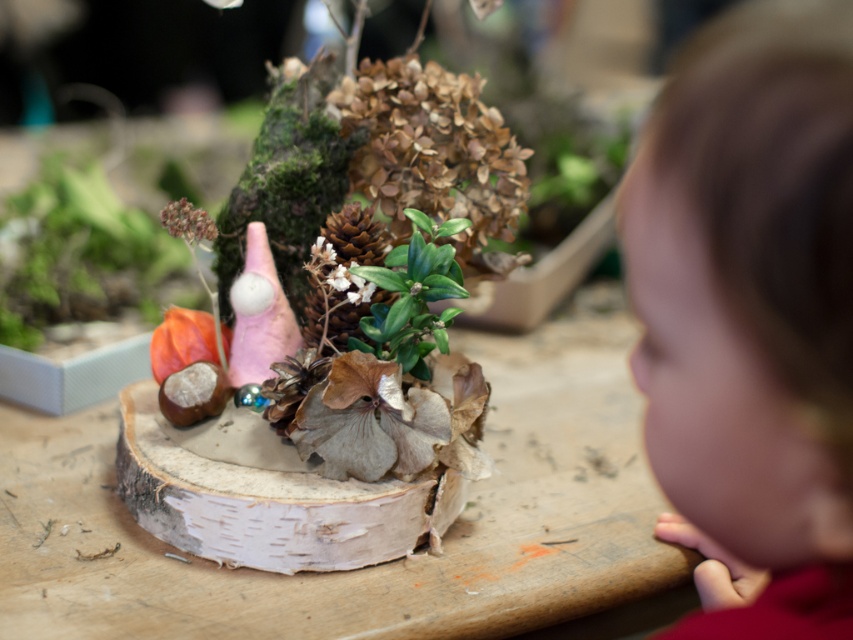
Does smooth brown hair at right appear under green leafy plant at center?

Yes, smooth brown hair at right is below green leafy plant at center.

Describe the element at coordinates (751, 316) in the screenshot. I see `smooth brown hair at right` at that location.

I want to click on smooth brown hair at right, so click(751, 316).

Measure the distance between orange matte pumpkin at left and brown matte pine cone at center.

A distance of 61.62 centimeters exists between orange matte pumpkin at left and brown matte pine cone at center.

Who is more distant from viewer, (129, 205) or (312, 266)?

Point (129, 205)

I want to click on orange matte pumpkin at left, so click(83, 257).

What do you see at coordinates (412, 296) in the screenshot?
I see `green leafy plant at center` at bounding box center [412, 296].

Is point (386, 262) in front of point (306, 296)?

That is True.

Find the location of `green leafy plant at center`. green leafy plant at center is located at coordinates (412, 296).